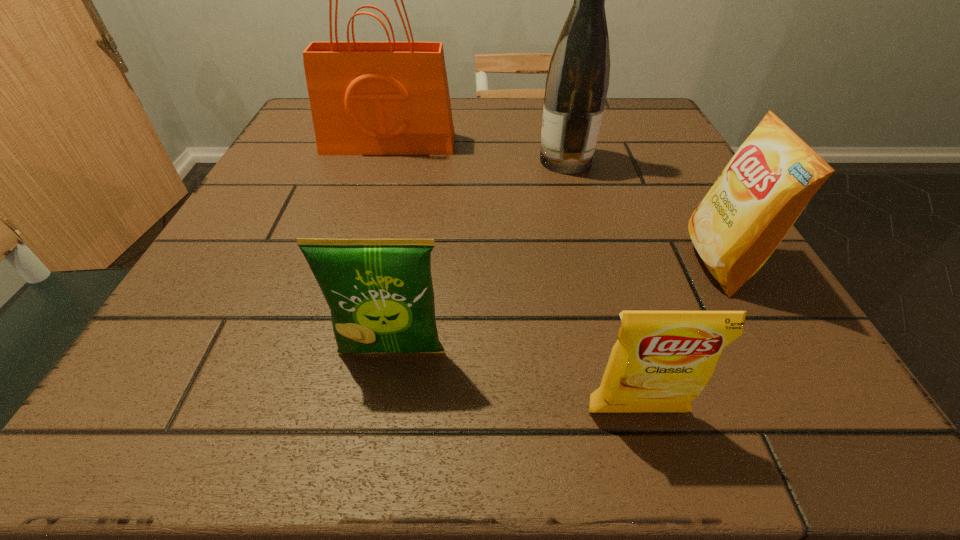
Where is `vacant region at the near edge`? Image resolution: width=960 pixels, height=540 pixels. vacant region at the near edge is located at coordinates pos(542,367).

In order to click on blank space at the left edge in this screenshot , I will do `click(247, 197)`.

Locate an element on the screen. vacant space at the right edge is located at coordinates (696, 176).

At what (x,y) coordinates should I click in order to perform the action: click on free location at the far right corner. Please return your answer as a coordinate pair (x, y). The height and width of the screenshot is (540, 960). Looking at the image, I should click on (677, 145).

Identify the location of free spot between the second crisp (potato chip) from right to left and the tote bag. (513, 278).

Where is `empty space between the nearest object and the second tallest object`? The height and width of the screenshot is (540, 960). empty space between the nearest object and the second tallest object is located at coordinates (601, 286).

Locate an element on the screen. vacant space in between the tallest object and the second crisp (potato chip) from left to right is located at coordinates (x=513, y=278).

I want to click on vacant space that's between the farthest crisp (potato chip) and the fourth shortest object, so click(x=642, y=211).

The image size is (960, 540). I want to click on vacant space in between the rightmost crisp (potato chip) and the second farthest crisp (potato chip), so click(555, 307).

Where is `vacant point located between the tote bag and the fourth shortest object`? The width and height of the screenshot is (960, 540). vacant point located between the tote bag and the fourth shortest object is located at coordinates (477, 152).